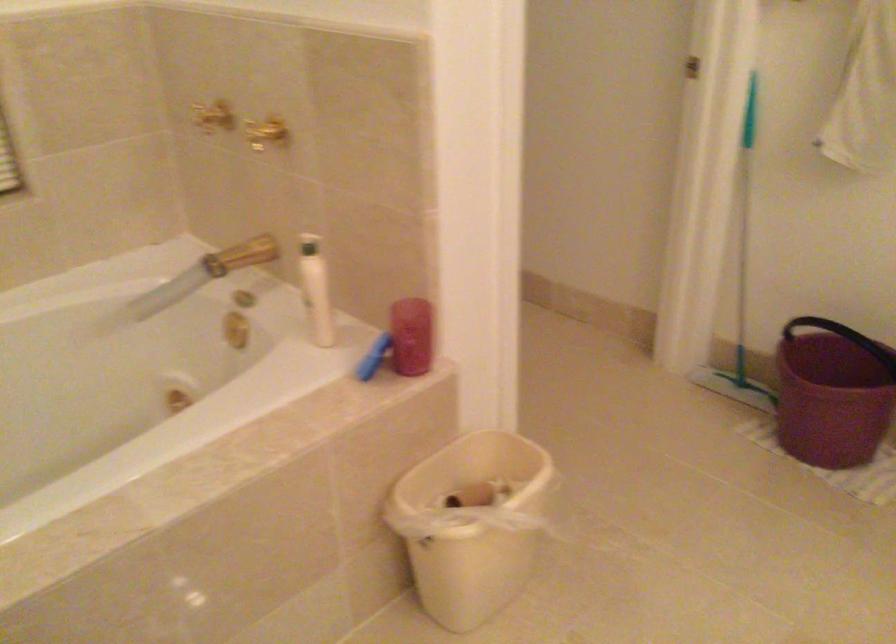
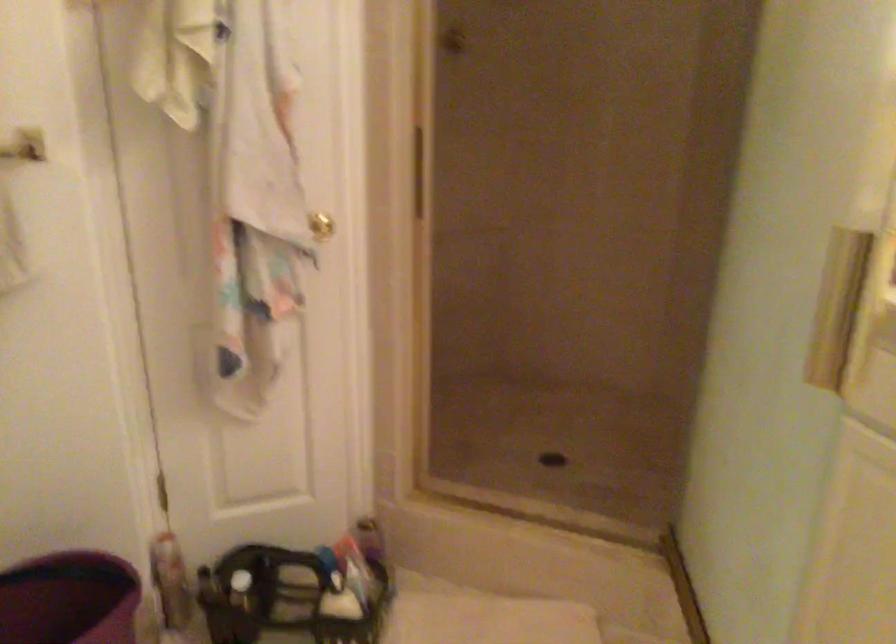
Question: How did the camera likely rotate?

Choices:
 (A) Left
 (B) Right
 (C) Up
 (D) Down

Answer: (B)